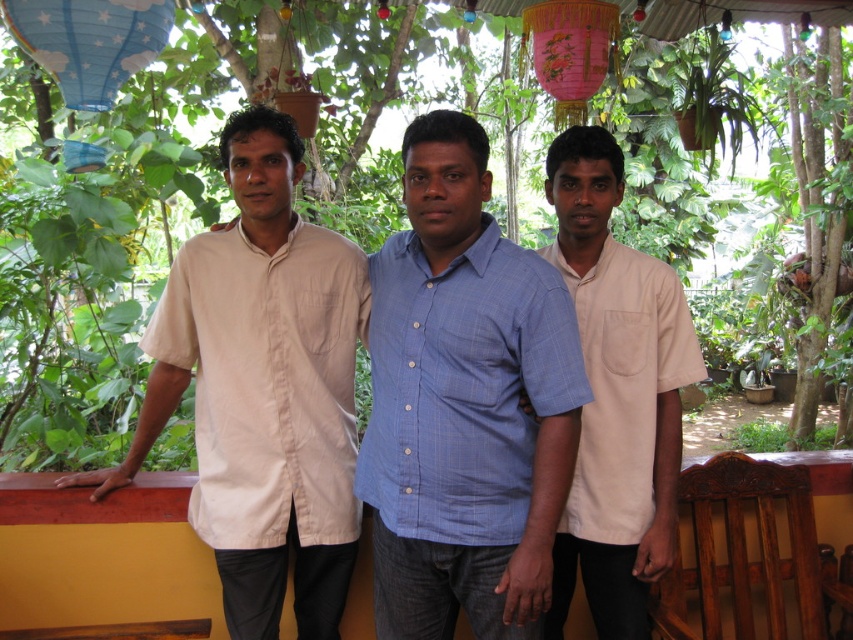
Question: Does blue checkered shirt at center appear under matte white shirt at left?

Choices:
 (A) no
 (B) yes

Answer: (B)

Question: Which point is closer to the camera?

Choices:
 (A) white cotton shirt at center
 (B) blue checkered shirt at center

Answer: (B)

Question: Which object is closer to the camera taking this photo?

Choices:
 (A) blue checkered shirt at center
 (B) white cotton shirt at center
 (C) matte white shirt at left

Answer: (A)

Question: Is matte white shirt at left thinner than white cotton shirt at center?

Choices:
 (A) yes
 (B) no

Answer: (B)

Question: Estimate the real-world distances between objects in this image. Which object is closer to the blue checkered shirt at center?

Choices:
 (A) matte white shirt at left
 (B) white cotton shirt at center

Answer: (B)

Question: Observing the image, what is the correct spatial positioning of blue checkered shirt at center in reference to white cotton shirt at center?

Choices:
 (A) left
 (B) right

Answer: (A)